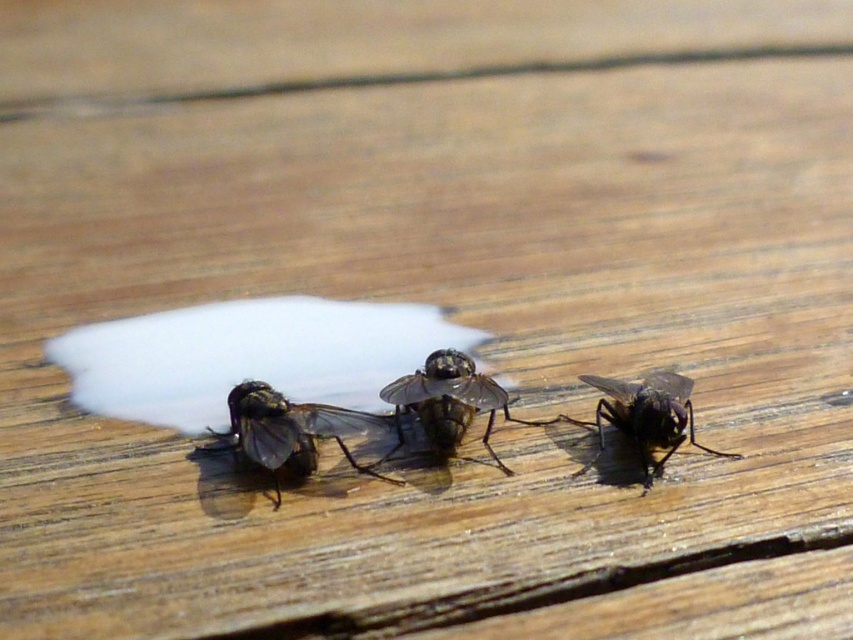
You are a scientist observing two insects on a wooden surface. You see a translucent dark at center and a black glossy fly at center. Which one is bigger?

The translucent dark at center is larger in size compared to the black glossy fly at center.

You are observing two flies on a wooden surface. The scene includes a shiny black fly at center and a black glossy fly at center. Which fly is located to the left of the other?

The shiny black fly at center is positioned on the left side of the black glossy fly at center.

You are an exterminator trying to determine which fly is smaller between the shiny black fly at center and the black glossy fly at center. Based on their spatial occupation, which one is smaller?

The shiny black fly at center is smaller than the black glossy fly at center because it occupies less space.